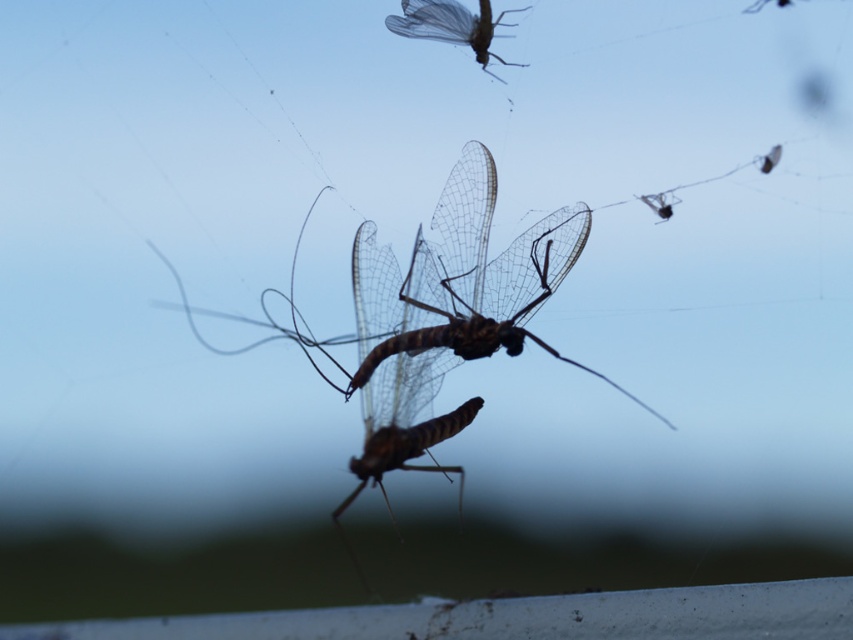
From the picture: You are an entomologist observing the spiderweb. You notice the translucent brown insect at center and the translucent winged insect at upper center. Which insect is positioned higher in the web?

The translucent winged insect at upper center is positioned higher in the web than the translucent brown insect at center.

You are an entomologist observing the spiderweb. You notice the translucent brown insect at center and the translucent winged insect at upper center. Which insect is positioned higher in the web?

The translucent winged insect at upper center is positioned higher in the web than the translucent brown insect at center.

You are an entomologist studying insects in a spiderweb. You observe a translucent brown insect at center. Can you determine its exact location in the image coordinates?

The translucent brown insect at center is located at point (439, 316).